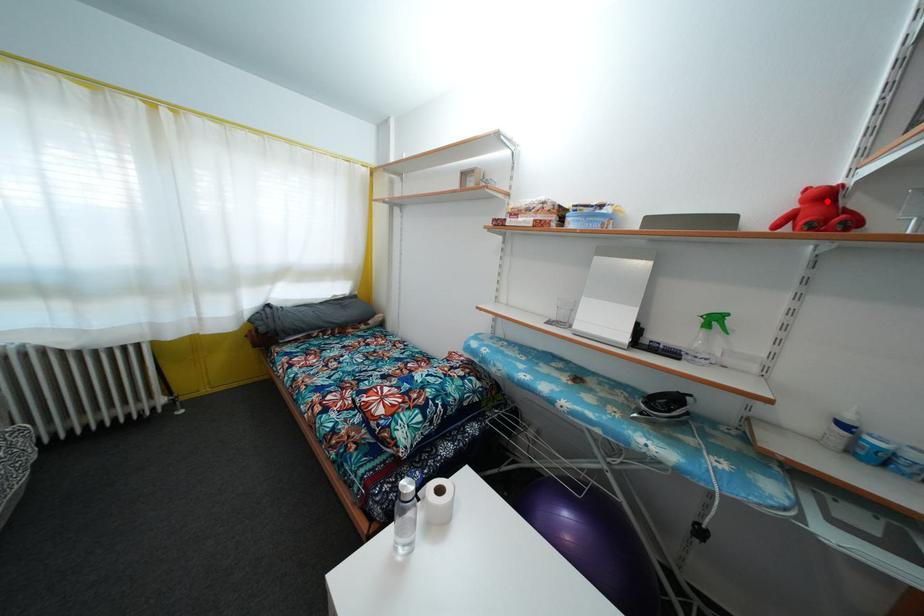
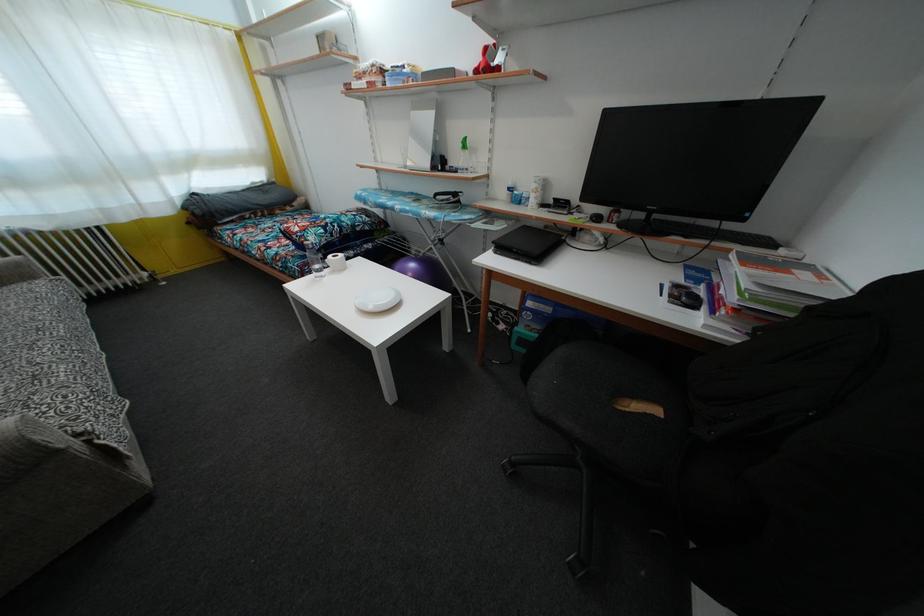
Where in the second image is the point corresponding to the highlighted location from the first image?

(490, 58)